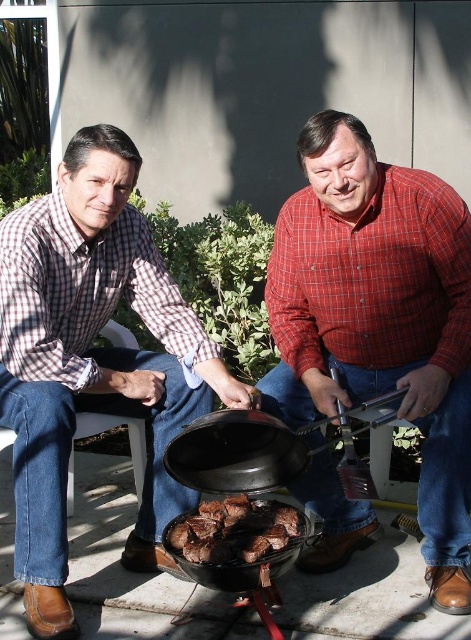
Can you confirm if red checkered shirt at center is smaller than brown matte/charred meat at center?

No.

Who is more distant from viewer, (x=344, y=273) or (x=172, y=540)?

The point (x=344, y=273) is behind.

At what (x,y) coordinates should I click in order to perform the action: click on red checkered shirt at center. Please return your answer as a coordinate pair (x, y). The height and width of the screenshot is (640, 471). Looking at the image, I should click on (380, 317).

Describe the element at coordinates (92, 360) in the screenshot. This screenshot has height=640, width=471. I see `plaid shirt at left` at that location.

Is point (64, 572) closer to camera compared to point (268, 540)?

No, it is behind (268, 540).

At what (x,y) coordinates should I click in order to perform the action: click on plaid shirt at left. Please return your answer as a coordinate pair (x, y). The height and width of the screenshot is (640, 471). Looking at the image, I should click on (92, 360).

Between red checkered shirt at center and plaid shirt at left, which one appears on the right side from the viewer's perspective?

red checkered shirt at center

Is red checkered shirt at center bigger than plaid shirt at left?

Actually, red checkered shirt at center might be smaller than plaid shirt at left.

Between point (446, 481) and point (164, 435), which one is positioned in front?

Point (446, 481) is in front.

Locate an element on the screen. The image size is (471, 640). red checkered shirt at center is located at coordinates (380, 317).